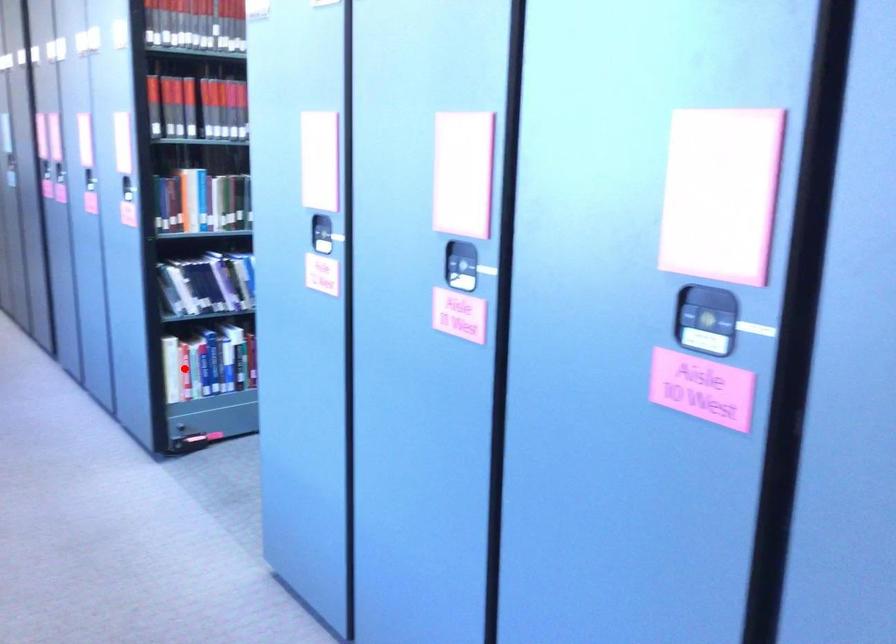
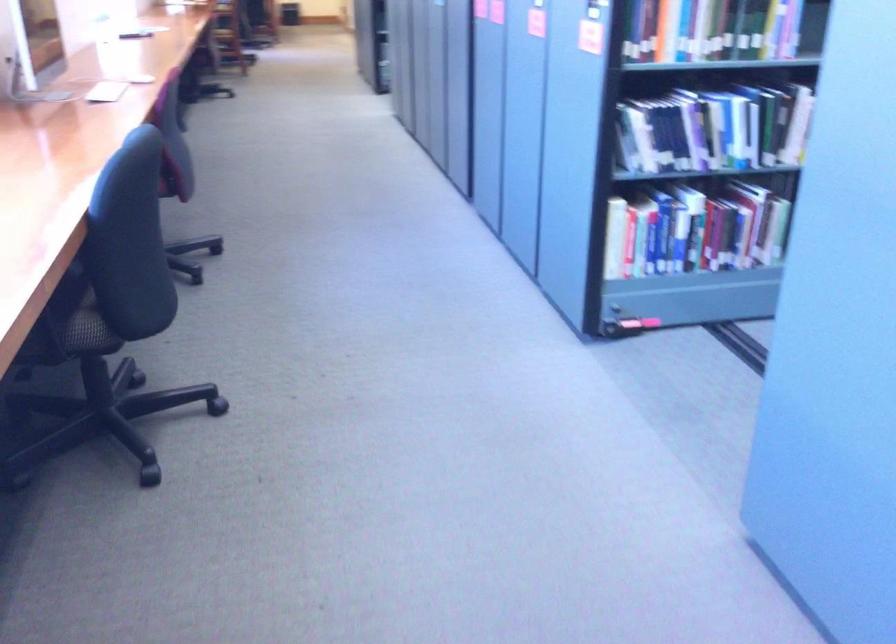
In the second image, find the point that corresponds to the highlighted location in the first image.

(630, 242)